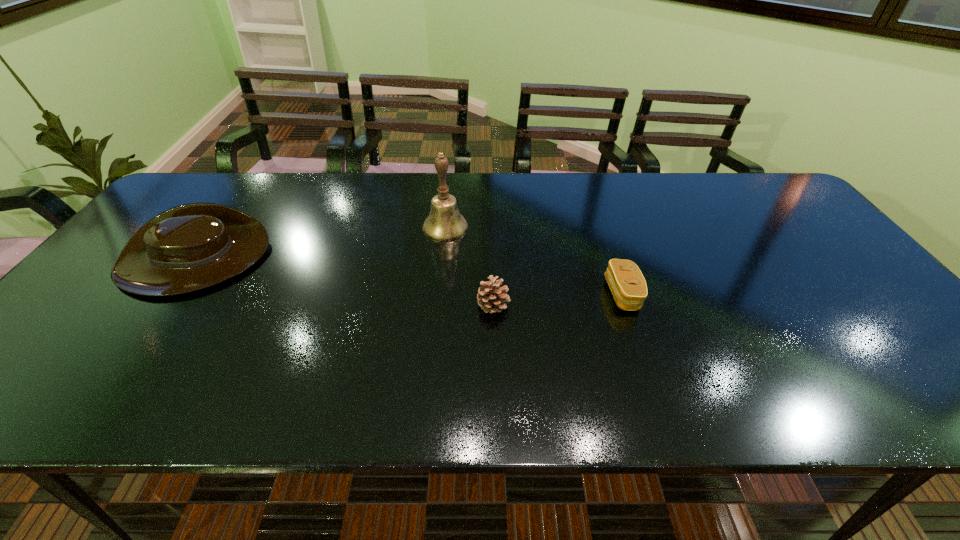
This screenshot has width=960, height=540. In order to click on bell in this screenshot , I will do (445, 223).

The height and width of the screenshot is (540, 960). Find the location of `the tallest object`. the tallest object is located at coordinates (445, 223).

Locate an element on the screen. The width and height of the screenshot is (960, 540). the leftmost object is located at coordinates (190, 247).

The width and height of the screenshot is (960, 540). Identify the location of the second object from right to left. (491, 298).

The image size is (960, 540). In order to click on the rightmost object in this screenshot , I will do `click(628, 286)`.

Locate an element on the screen. This screenshot has width=960, height=540. the shortest object is located at coordinates (628, 286).

Find the location of `free space located 0.390m on the front of the bell`. free space located 0.390m on the front of the bell is located at coordinates (433, 354).

Locate an element on the screen. free spot located on the right of the leftmost object is located at coordinates (410, 260).

This screenshot has width=960, height=540. Identify the location of free space located 0.360m on the left of the third object from left to right. (326, 305).

Where is `free space located on the zipper side of the clutch bag`? Image resolution: width=960 pixels, height=540 pixels. free space located on the zipper side of the clutch bag is located at coordinates (570, 294).